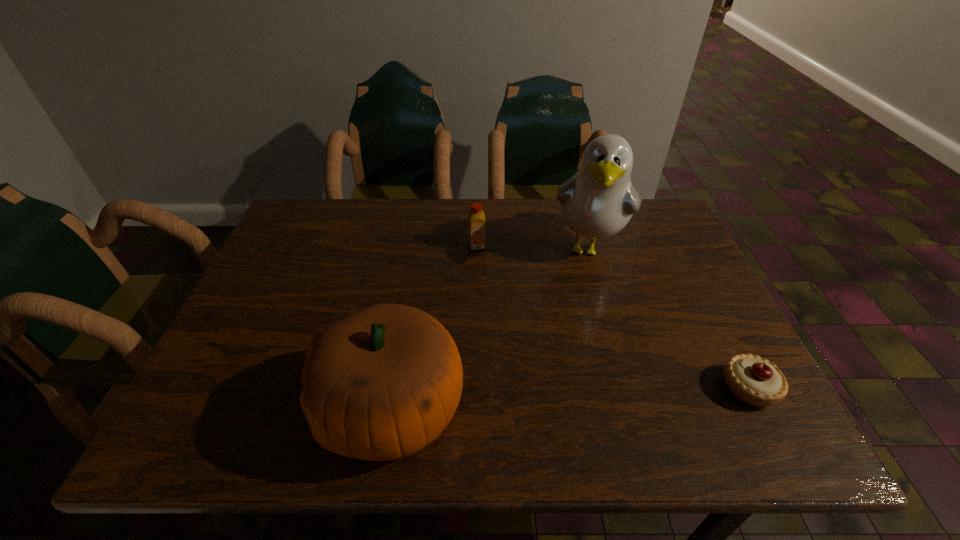
Identify the location of vacant space at the left edge of the desktop. The height and width of the screenshot is (540, 960). (275, 326).

Find the location of a particular element. Image resolution: width=960 pixels, height=540 pixels. vacant space at the right edge of the desktop is located at coordinates (650, 298).

At what (x,y) coordinates should I click in order to perform the action: click on free space at the far left corner of the desktop. Please return your answer as a coordinate pair (x, y). Looking at the image, I should click on (300, 202).

Where is `vacant area that lies between the gull and the third shortest object`? The height and width of the screenshot is (540, 960). vacant area that lies between the gull and the third shortest object is located at coordinates (490, 328).

The image size is (960, 540). I want to click on vacant area that lies between the third tallest object and the pastry, so click(612, 317).

Find the location of a particular element. This screenshot has width=960, height=540. free spot between the rightmost object and the second object from right to left is located at coordinates (668, 318).

You are a GUI agent. You are given a task and a screenshot of the screen. Output one action in this format:
    pyautogui.click(x=<x>, y=<y>)
    Task: Click on the empty space that is in between the third shortest object and the rightmost object
    Image resolution: width=960 pixels, height=540 pixels.
    Given the screenshot: What is the action you would take?
    pyautogui.click(x=570, y=398)

I want to click on free spot between the rightmost object and the second tallest object, so click(x=570, y=398).

Identify the location of vacant area between the tallest object and the second tallest object. The image size is (960, 540). (490, 328).

Image resolution: width=960 pixels, height=540 pixels. In order to click on vacant point located between the shortest object and the tallest object in this screenshot , I will do `click(668, 318)`.